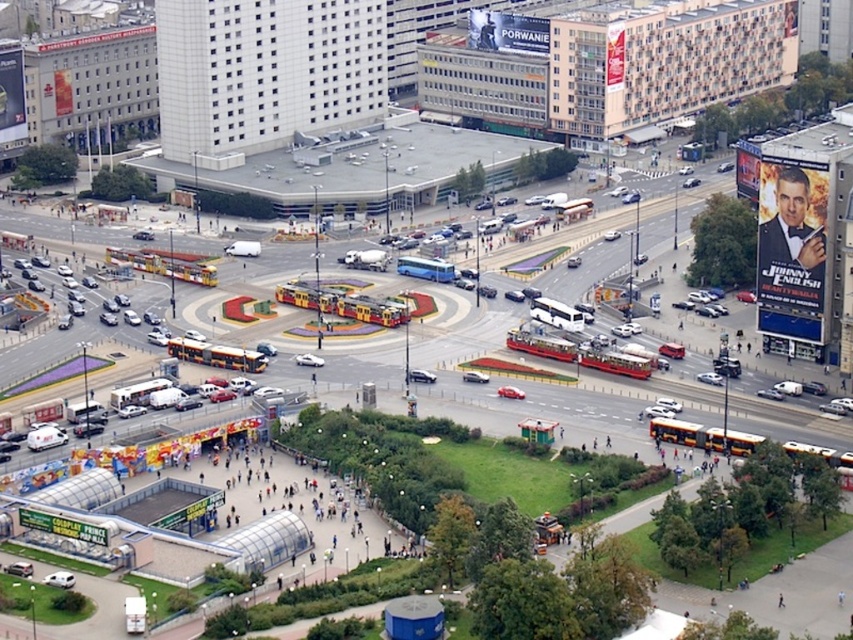
You are a pedestrian standing at the roundabout and want to locate both the metallic silver billboard at upper center and the white glossy billboard at upper right. From your current position, which direction should you face to see both billboards in your field of view?

You should face north to see both the metallic silver billboard at upper center and the white glossy billboard at upper right because the metallic silver billboard at upper center is to the left of the white glossy billboard at upper right.